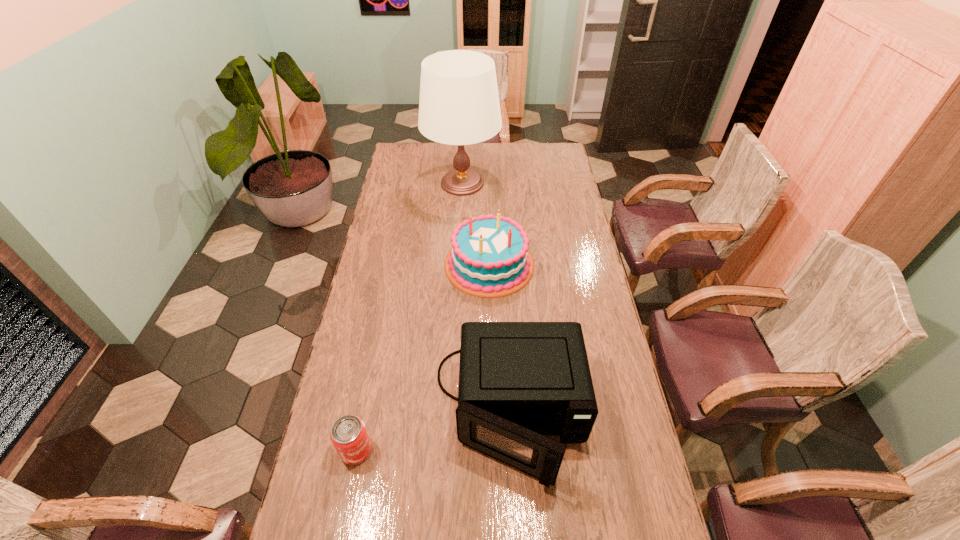
The width and height of the screenshot is (960, 540). Identify the location of object that is at the left edge. (349, 436).

Image resolution: width=960 pixels, height=540 pixels. In order to click on object that is at the right edge in this screenshot , I will do [x=518, y=381].

In the image, there is a desktop. Where is `vacant space at the far edge`? Image resolution: width=960 pixels, height=540 pixels. vacant space at the far edge is located at coordinates (505, 159).

Where is `vacant region at the left edge of the desktop`? Image resolution: width=960 pixels, height=540 pixels. vacant region at the left edge of the desktop is located at coordinates (379, 299).

The image size is (960, 540). In the image, there is a desktop. What are the coordinates of `vacant space at the right edge` in the screenshot? It's located at (550, 234).

The width and height of the screenshot is (960, 540). I want to click on free space between the can and the farthest object, so click(x=409, y=316).

Where is `unoccupied area between the birthday cake and the can`? unoccupied area between the birthday cake and the can is located at coordinates (422, 357).

Where is `unoccupied position between the birthday cake and the shortest object`? unoccupied position between the birthday cake and the shortest object is located at coordinates (422, 357).

Where is `unoccupied position between the farthest object and the can`? This screenshot has height=540, width=960. unoccupied position between the farthest object and the can is located at coordinates (409, 316).

Find the location of a particular element. Image resolution: width=960 pixels, height=540 pixels. unoccupied position between the microwave oven and the tallest object is located at coordinates (487, 298).